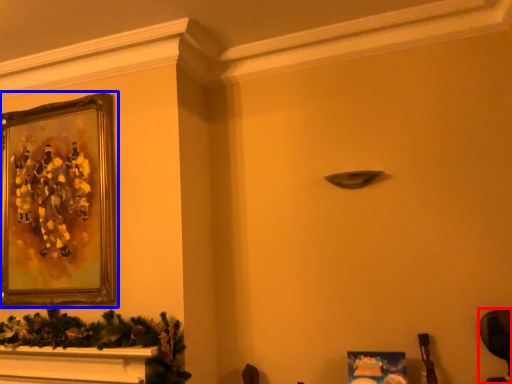
Question: Among these objects, which one is nearest to the camera, swivel chair (highlighted by a red box) or picture frame (highlighted by a blue box)?

Choices:
 (A) swivel chair
 (B) picture frame

Answer: (A)